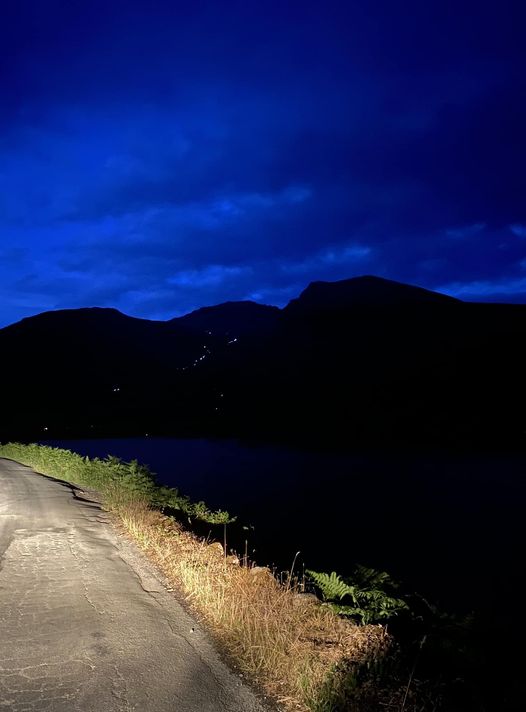
The width and height of the screenshot is (526, 712). Identify the location of lights. (196, 357), (226, 340), (114, 391).